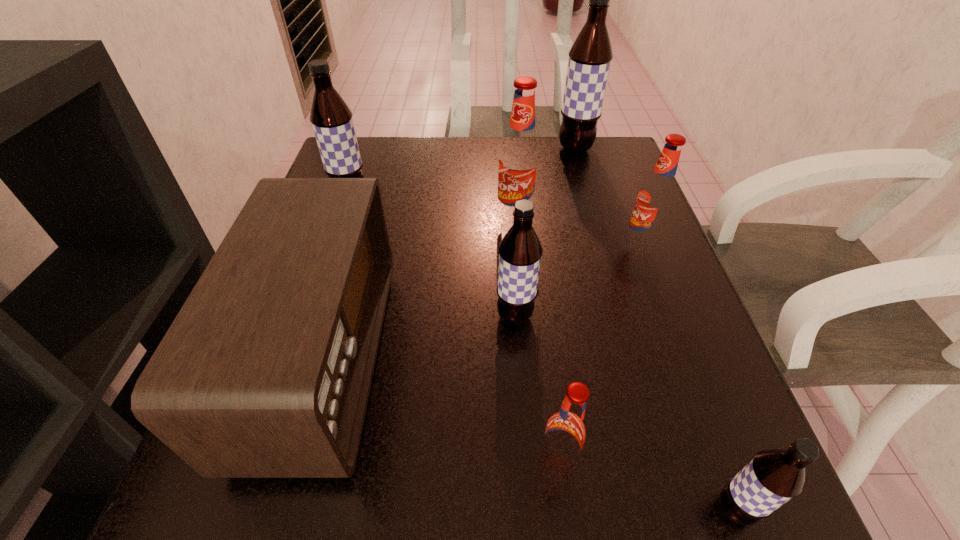
At what (x,y) coordinates should I click in order to perform the action: click on vacant point at the right edge. Please return your answer as a coordinate pair (x, y). The height and width of the screenshot is (540, 960). Looking at the image, I should click on (583, 201).

This screenshot has height=540, width=960. In order to click on blank area at the far left corner in this screenshot , I will do `click(374, 137)`.

Where is `free space at the far right corner of the desktop`? This screenshot has height=540, width=960. free space at the far right corner of the desktop is located at coordinates (627, 159).

This screenshot has width=960, height=540. Identify the location of blank region between the biggest red root beer and the second farthest brown root beer. (434, 208).

Image resolution: width=960 pixels, height=540 pixels. I want to click on vacant region between the farthest red root beer and the farthest root beer, so click(545, 184).

Image resolution: width=960 pixels, height=540 pixels. I want to click on free area in between the nearest root beer and the farthest brown root beer, so click(x=655, y=329).

The image size is (960, 540). Find the location of `free area in between the second farthest brown root beer and the tallest root beer`. free area in between the second farthest brown root beer and the tallest root beer is located at coordinates (463, 173).

Find the location of `empty space that is in between the third nearest root beer and the fourth farthest object`. empty space that is in between the third nearest root beer and the fourth farthest object is located at coordinates (578, 281).

The height and width of the screenshot is (540, 960). Identify the location of unoccupied area between the second farthest brown root beer and the nearest red root beer. (455, 328).

Identify the location of vacant space that is in between the farthest red root beer and the third nearest brown root beer. (434, 208).